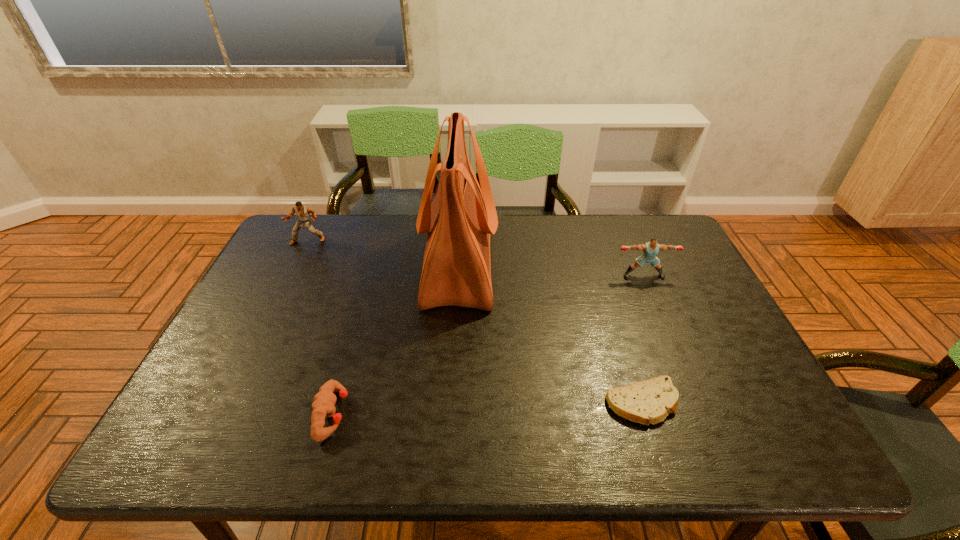
At what (x,y) coordinates should I click in order to perform the action: click on empty space between the rightmost puncher and the second shortest object. Please return your answer as a coordinate pair (x, y). The width and height of the screenshot is (960, 540). Looking at the image, I should click on (488, 345).

I want to click on vacant space that is in between the rightmost puncher and the shortest puncher, so click(488, 345).

The height and width of the screenshot is (540, 960). What are the coordinates of `unoccupied position between the farthest puncher and the shortest object` in the screenshot? It's located at (475, 322).

Locate an element on the screen. The width and height of the screenshot is (960, 540). vacant area between the shortest object and the shopping bag is located at coordinates (550, 334).

What are the coordinates of `object that stands as the third closest to the leftmost object` in the screenshot? It's located at (650, 249).

The height and width of the screenshot is (540, 960). Identify the location of object identified as the third closest to the shortest object. (323, 406).

Where is `the closest puncher relative to the second puncher from right to left`? the closest puncher relative to the second puncher from right to left is located at coordinates (303, 212).

Locate an element on the screen. puncher object that ranks as the closest to the third object from left to right is located at coordinates (323, 406).

The width and height of the screenshot is (960, 540). I want to click on vacant point that satisfies the following two spatial constraints: 1. on the front pocket of the tallest object; 2. on the left side of the shortest object, so click(x=450, y=403).